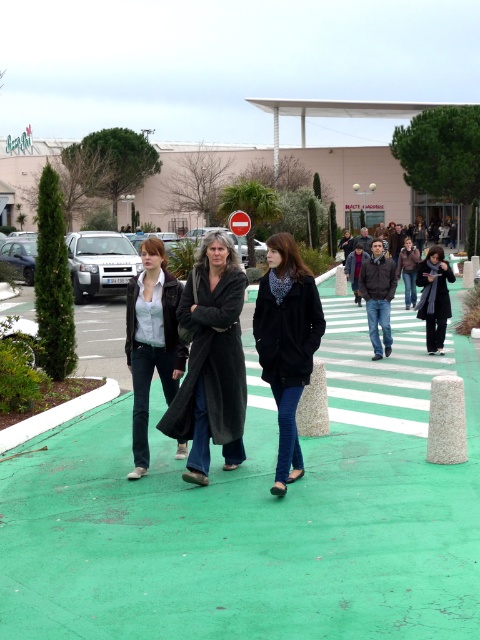
You are a fashion designer observing the pedestrians on the bright green pedestrian crossing. You notice two coats labeled as dark gray wool coat at center and dark gray coat at center. Which one is closer to the ground?

The dark gray wool coat at center is positioned under the dark gray coat at center, so it is closer to the ground.

Looking at this image, you are a delivery robot with a width of 1.2 meters. You need to move from the green rubber pavement at center to the dark gray wool coat at center. Can you fit through the space between them?

The distance between the green rubber pavement at center and the dark gray wool coat at center is 1.64 meters. Since the robot is 1.2 meters wide, there is enough space for it to pass through.